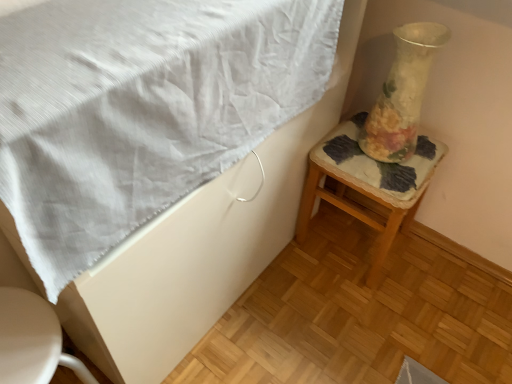
Question: Should I look upward or downward to see white glossy toilet at lower left?

Choices:
 (A) up
 (B) down

Answer: (B)

Question: Does white textured blanket at upper left have a greater width compared to translucent glass vase at right?

Choices:
 (A) yes
 (B) no

Answer: (A)

Question: Does white textured blanket at upper left have a lesser width compared to translucent glass vase at right?

Choices:
 (A) yes
 (B) no

Answer: (B)

Question: Does white textured blanket at upper left come behind translucent glass vase at right?

Choices:
 (A) yes
 (B) no

Answer: (B)

Question: Can you confirm if white textured blanket at upper left is shorter than translucent glass vase at right?

Choices:
 (A) no
 (B) yes

Answer: (B)

Question: Does white textured blanket at upper left touch translucent glass vase at right?

Choices:
 (A) yes
 (B) no

Answer: (B)

Question: Is white textured blanket at upper left to the left of translucent glass vase at right from the viewer's perspective?

Choices:
 (A) yes
 (B) no

Answer: (A)

Question: Can you confirm if white textured blanket at upper left is shorter than white glossy toilet at lower left?

Choices:
 (A) yes
 (B) no

Answer: (A)

Question: Is white textured blanket at upper left positioned in front of white glossy toilet at lower left?

Choices:
 (A) no
 (B) yes

Answer: (B)

Question: From the image's perspective, is white textured blanket at upper left over white glossy toilet at lower left?

Choices:
 (A) yes
 (B) no

Answer: (A)

Question: Is white textured blanket at upper left beside white glossy toilet at lower left?

Choices:
 (A) no
 (B) yes

Answer: (A)

Question: Is white textured blanket at upper left wider than white glossy toilet at lower left?

Choices:
 (A) no
 (B) yes

Answer: (B)

Question: Can you confirm if white textured blanket at upper left is smaller than white glossy toilet at lower left?

Choices:
 (A) yes
 (B) no

Answer: (B)

Question: From a real-world perspective, is translucent glass vase at right located beneath white glossy toilet at lower left?

Choices:
 (A) no
 (B) yes

Answer: (A)